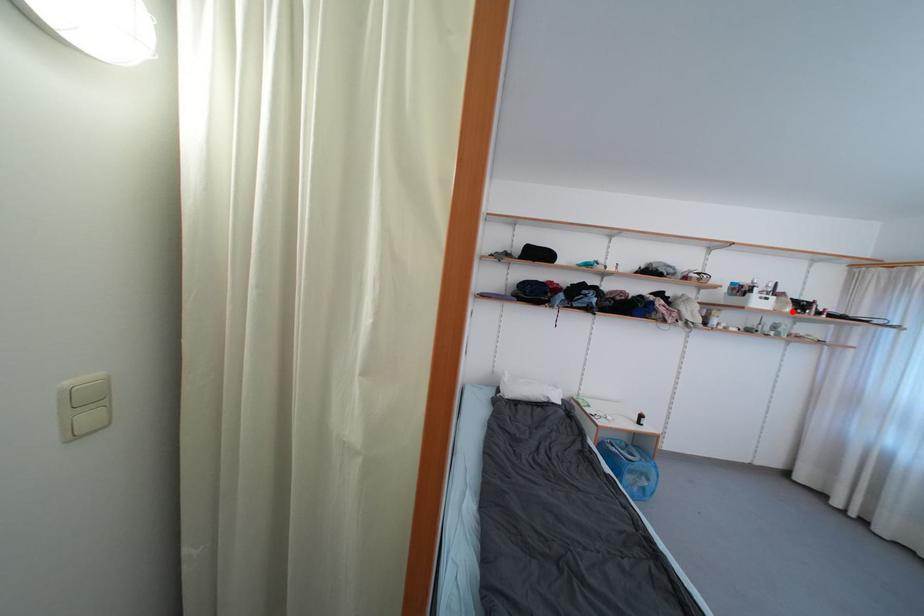
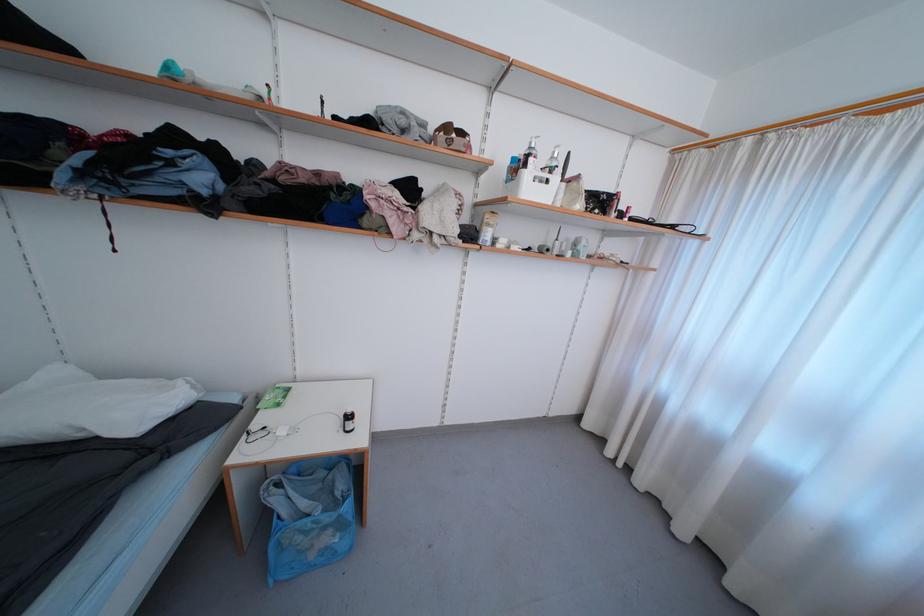
In the second image, find the point that corresponds to the highlighted location in the first image.

(584, 208)